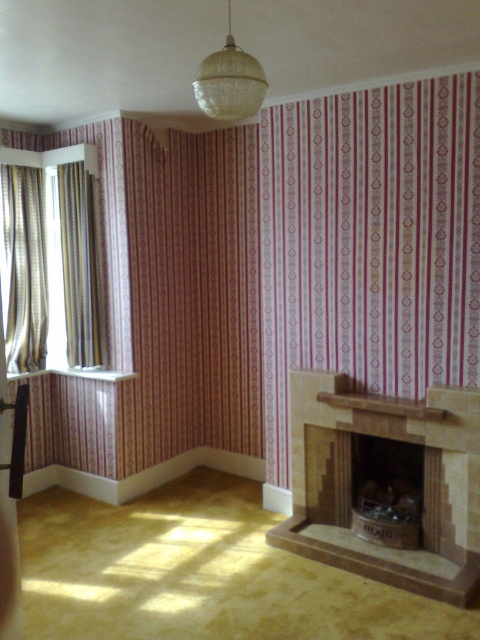
Based on the photo, you are standing in the cozy corner of the room and want to open the curtains to let in more light. Which curtain should you move first, the silky gold curtains at left or the striped fabric curtain at left?

The silky gold curtains at left is in front of the striped fabric curtain at left, so you should move the silky gold curtains at left first to let in more light.

You are planning to hang a small painting between the silky gold curtains at left and the striped fabric curtain at left. The painting is 10 inches wide. Will there be enough space between them to fit the painting?

The silky gold curtains at left and striped fabric curtain at left are 9.96 inches apart. Since the painting is 10 inches wide, there is not enough space to fit it between them.